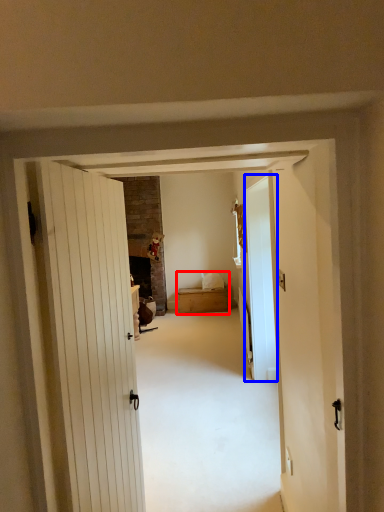
Question: Which of the following is the closest to the observer, bed (highlighted by a red box) or glass door (highlighted by a blue box)?

Choices:
 (A) bed
 (B) glass door

Answer: (B)